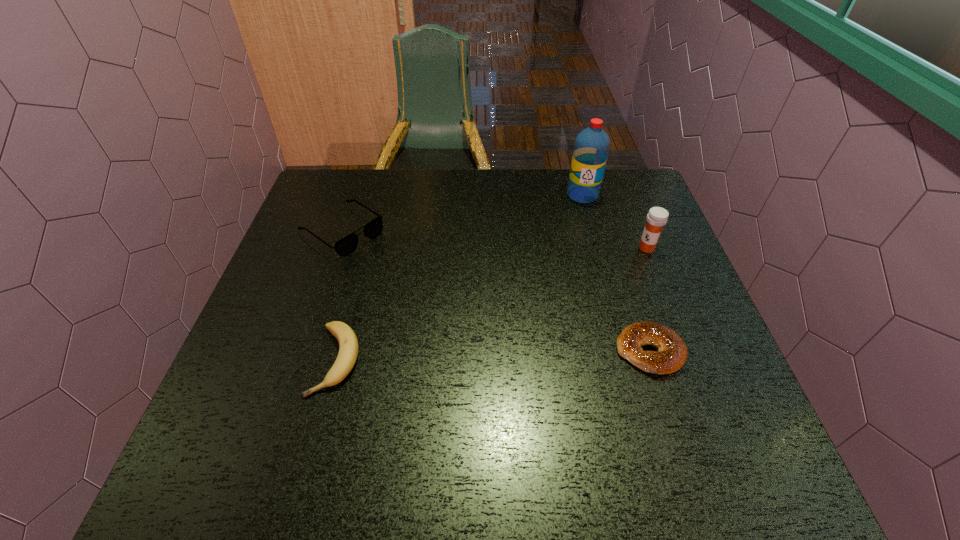
I want to click on banana, so click(x=348, y=344).

Locate an element on the screen. The image size is (960, 540). bagel is located at coordinates (671, 354).

Find the location of a particular element. the third shortest object is located at coordinates (345, 246).

You are a GUI agent. You are given a task and a screenshot of the screen. Output one action in this format:
    pyautogui.click(x=<x>, y=<y>)
    Task: Click on the medicine
    The image size is (960, 540).
    Given the screenshot: What is the action you would take?
    pyautogui.click(x=657, y=217)

The width and height of the screenshot is (960, 540). In order to click on water bottle in this screenshot , I will do [591, 148].

Find the location of `the tallest object`. the tallest object is located at coordinates (591, 148).

In order to click on vacant region located 0.260m on the back of the bagel in this screenshot , I will do `click(617, 250)`.

This screenshot has width=960, height=540. In order to click on free location located 0.210m on the front-facing side of the third shortest object in this screenshot , I will do `click(424, 287)`.

Where is `free region located on the front-facing side of the third shortest object`? This screenshot has height=540, width=960. free region located on the front-facing side of the third shortest object is located at coordinates point(453,307).

Identify the location of vacant region located 0.090m on the front-facing side of the third shortest object. (392, 265).